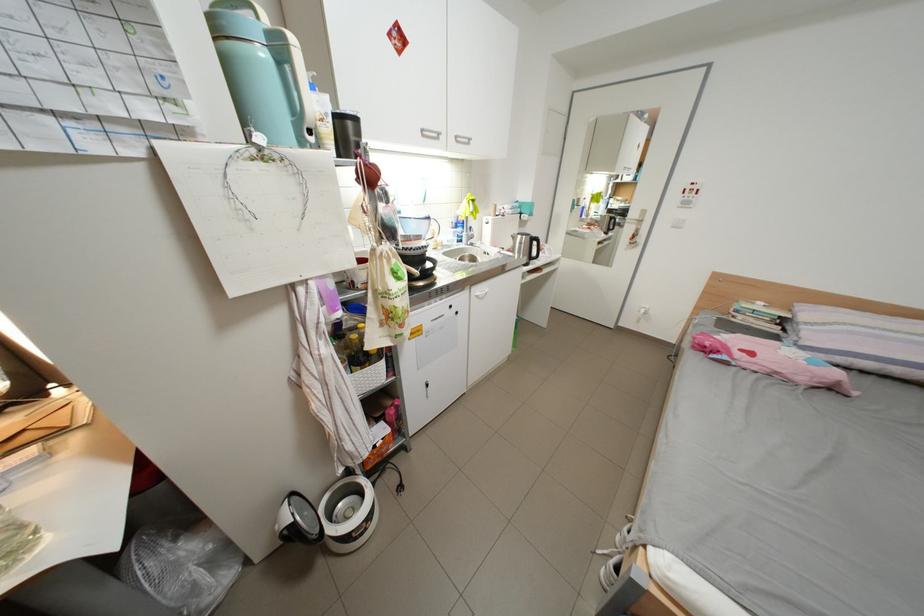
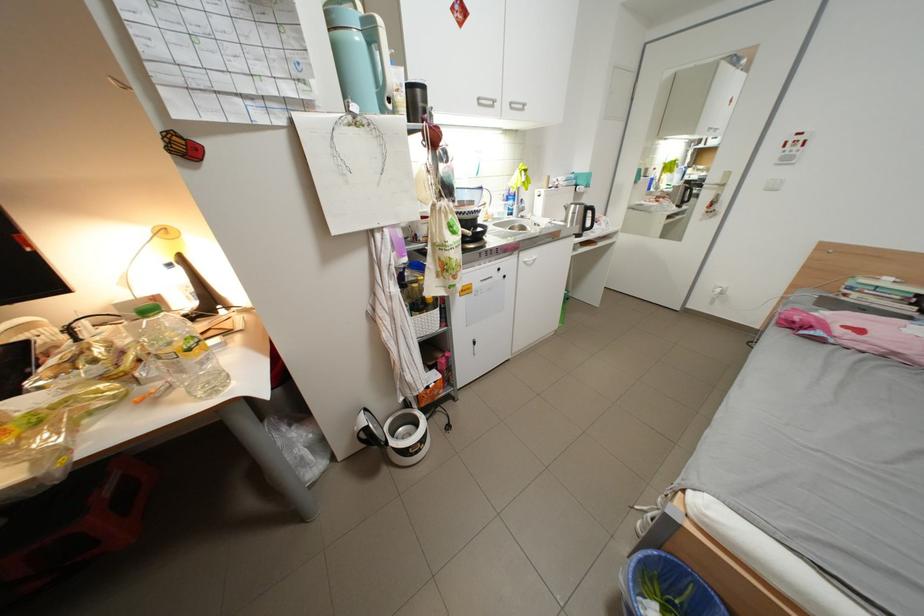
The point at (468,139) is marked in the first image. Where is the corresponding point in the second image?

(523, 105)